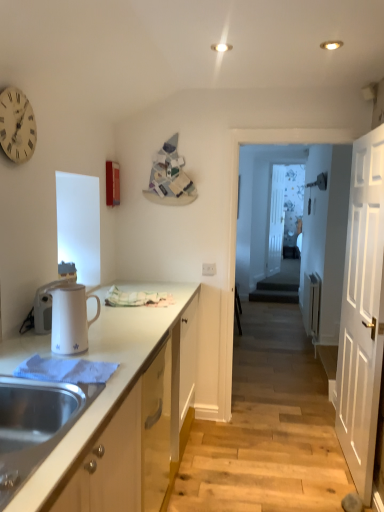
Question: Can you confirm if white wooden clock at upper left is positioned to the right of white wooden door at right?

Choices:
 (A) no
 (B) yes

Answer: (A)

Question: Is white wooden clock at upper left shorter than white wooden door at right?

Choices:
 (A) no
 (B) yes

Answer: (B)

Question: From a real-world perspective, is white wooden clock at upper left physically above white wooden door at right?

Choices:
 (A) no
 (B) yes

Answer: (B)

Question: Is white wooden clock at upper left positioned before white wooden door at right?

Choices:
 (A) yes
 (B) no

Answer: (A)

Question: Can you confirm if white wooden clock at upper left is bigger than white wooden door at right?

Choices:
 (A) no
 (B) yes

Answer: (A)

Question: Considering the positions of white wooden door at right and white glossy electric kettle at left, which is counted as the first appliance, starting from the back, in the image, is white wooden door at right bigger or smaller than white glossy electric kettle at left, which is counted as the first appliance, starting from the back,?

Choices:
 (A) small
 (B) big

Answer: (B)

Question: From the image's perspective, is white wooden door at right above or below white glossy electric kettle at left, the 2th appliance from the right?

Choices:
 (A) above
 (B) below

Answer: (B)

Question: Is white wooden door at right inside or outside of white glossy electric kettle at left, the second appliance in the front-to-back sequence?

Choices:
 (A) outside
 (B) inside

Answer: (A)

Question: From a real-world perspective, is white wooden door at right above or below white glossy electric kettle at left, acting as the 1th appliance starting from the left?

Choices:
 (A) below
 (B) above

Answer: (A)

Question: In terms of height, does transparent glass door at center, which appears as the second glass door when viewed from the back, look taller or shorter compared to white wooden clock at upper left?

Choices:
 (A) tall
 (B) short

Answer: (A)

Question: Visually, is transparent glass door at center, which appears as the second glass door when viewed from the back, positioned to the left or to the right of white wooden clock at upper left?

Choices:
 (A) left
 (B) right

Answer: (B)

Question: From a real-world perspective, is transparent glass door at center, which appears as the second glass door when viewed from the back, positioned above or below white wooden clock at upper left?

Choices:
 (A) above
 (B) below

Answer: (B)

Question: Is transparent glass door at center, which appears as the second glass door when viewed from the back, in front of or behind white wooden clock at upper left in the image?

Choices:
 (A) behind
 (B) front

Answer: (A)

Question: Choose the correct answer: Is white glossy cabinet at lower left inside transparent glass door at center, which appears as the second glass door when viewed from the back, or outside it?

Choices:
 (A) inside
 (B) outside

Answer: (B)

Question: In the image, is white glossy cabinet at lower left positioned in front of or behind transparent glass door at center, which appears as the second glass door when viewed from the back?

Choices:
 (A) behind
 (B) front

Answer: (B)